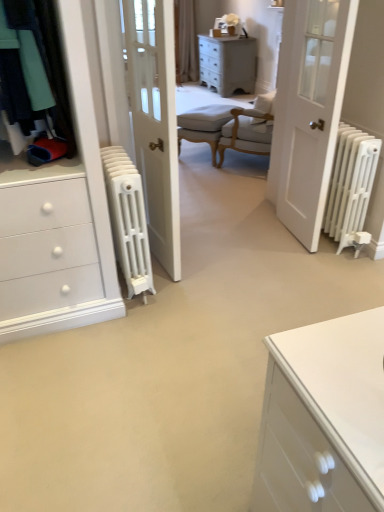
This screenshot has height=512, width=384. I want to click on vacant region in front of white matte radiator at left, which is the second radiator from right to left, so click(129, 332).